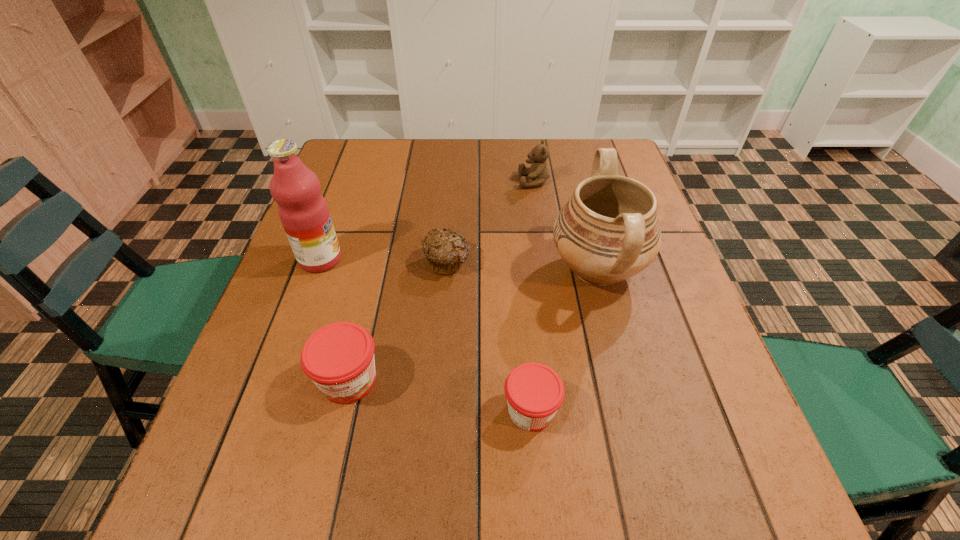
Locate an element on the screen. The width and height of the screenshot is (960, 540). free space located on the front-facing side of the fifth shortest object is located at coordinates (423, 269).

Locate an element on the screen. This screenshot has width=960, height=540. vacant space situated on the front-facing side of the fifth shortest object is located at coordinates (514, 269).

Locate an element on the screen. The image size is (960, 540). vacant area situated 0.250m on the front-facing side of the fifth shortest object is located at coordinates (441, 269).

Identify the location of vacant region located 0.320m on the label of the leftmost object. The image size is (960, 540). (476, 259).

At what (x,y) coordinates should I click in order to perform the action: click on free space located 0.300m on the front-facing side of the farthest object. Please return your answer as a coordinate pair (x, y). Looking at the image, I should click on (415, 181).

You are a GUI agent. You are given a task and a screenshot of the screen. Output one action in this format:
    pyautogui.click(x=<x>, y=<y>)
    Task: Click on the vacant space positioned 0.230m on the front-facing side of the farthest object
    This screenshot has height=540, width=960.
    Given the screenshot: What is the action you would take?
    pyautogui.click(x=439, y=181)

Locate an element on the screen. vacant space situated on the front-facing side of the farthest object is located at coordinates (397, 181).

The height and width of the screenshot is (540, 960). In order to click on blank space located 0.100m on the right of the muffin in this screenshot , I will do point(513,262).

Identify the location of object that is at the far edge. pos(537,173).

I want to click on jam that is at the left edge, so click(339, 358).